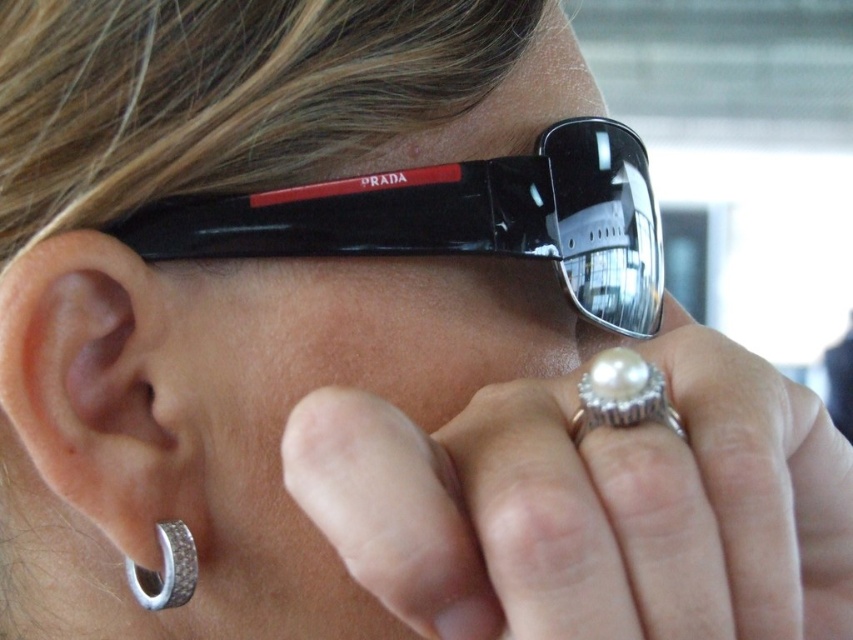
Question: Is black plastic sunglasses at upper center to the left of pearlsmoothring at right from the viewer's perspective?

Choices:
 (A) yes
 (B) no

Answer: (A)

Question: Among these objects, which one is nearest to the camera?

Choices:
 (A) silver/diamond hoop earring at lower left
 (B) black plastic sunglasses at upper center

Answer: (A)

Question: Based on their relative distances, which object is farther from the black plastic sunglasses at upper center?

Choices:
 (A) pearlsmoothring at right
 (B) silver textured ring at ear
 (C) silver/diamond hoop earring at lower left

Answer: (A)

Question: From the image, what is the correct spatial relationship of black plastic sunglasses at upper center in relation to silver/diamond hoop earring at lower left?

Choices:
 (A) left
 (B) right

Answer: (B)

Question: Estimate the real-world distances between objects in this image. Which object is closer to the silver textured ring at ear?

Choices:
 (A) pearlsmoothring at right
 (B) silver/diamond hoop earring at lower left

Answer: (B)

Question: Is pearlsmoothring at right to the right of silver textured ring at ear from the viewer's perspective?

Choices:
 (A) no
 (B) yes

Answer: (B)